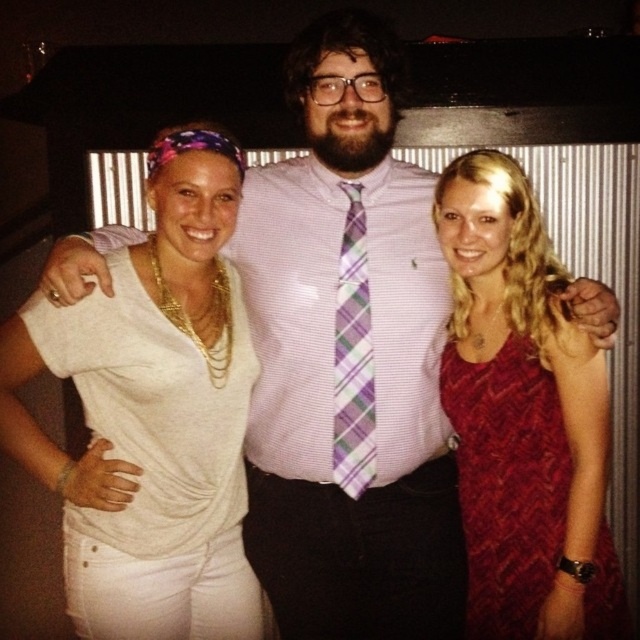
Question: Which point is farther to the camera?

Choices:
 (A) (596, 627)
 (B) (209, 312)

Answer: (B)

Question: Is white matte shirt at center above plaid fabric tie at center?

Choices:
 (A) no
 (B) yes

Answer: (A)

Question: Based on their relative distances, which object is nearer to the white matte shirt at center?

Choices:
 (A) plaid fabric tie at center
 (B) matte red dress at center

Answer: (A)

Question: Is the position of white matte shirt at center more distant than that of matte red dress at center?

Choices:
 (A) yes
 (B) no

Answer: (B)

Question: Is matte red dress at center in front of plaid fabric tie at center?

Choices:
 (A) no
 (B) yes

Answer: (B)

Question: Which point is farther to the camera?

Choices:
 (A) plaid fabric tie at center
 (B) matte red dress at center

Answer: (A)